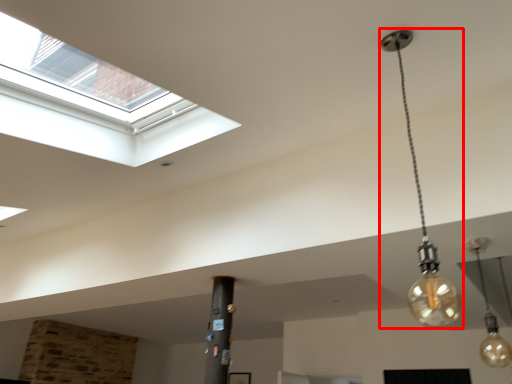
Question: Observing the image, what is the correct spatial positioning of lamp (annotated by the red box) in reference to lamp?

Choices:
 (A) right
 (B) left

Answer: (B)